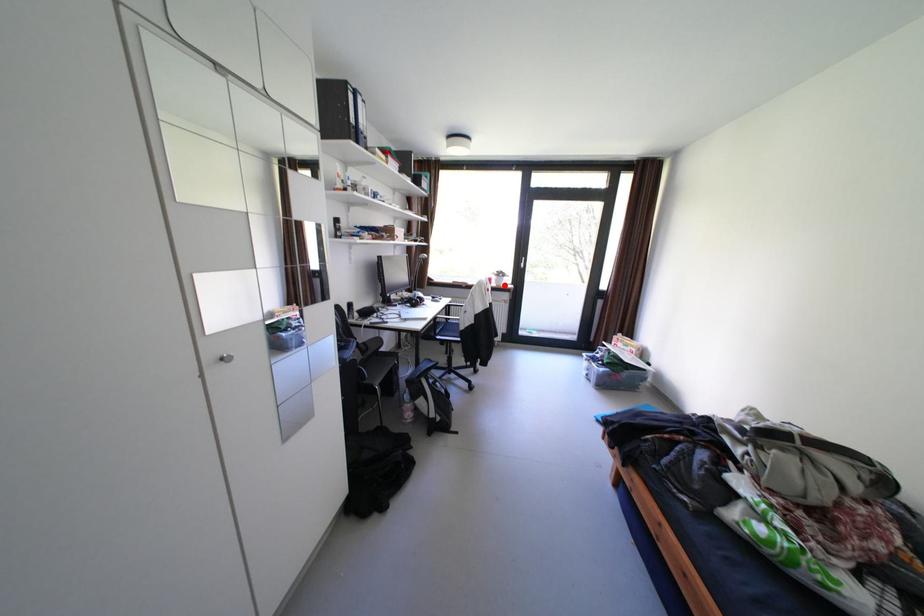
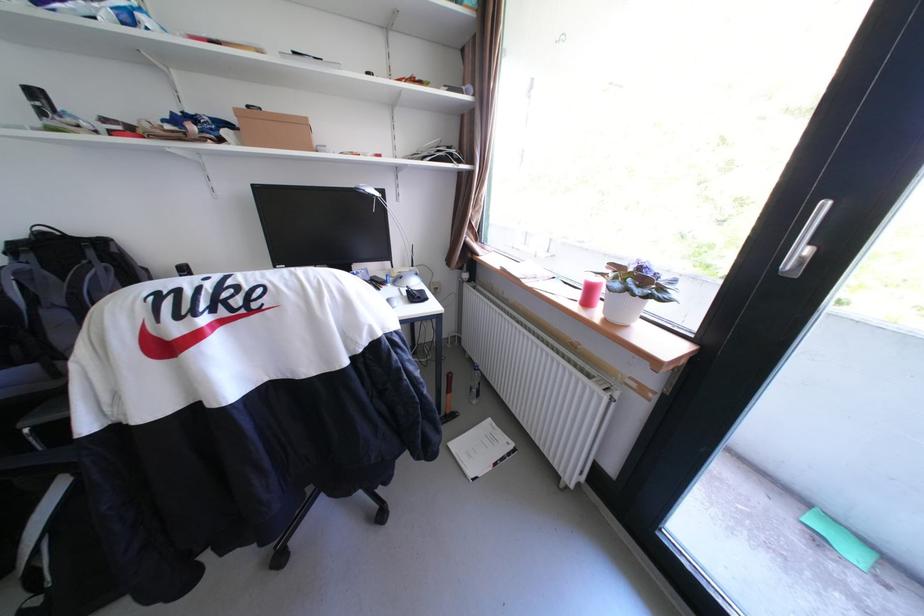
In the second image, find the point that corresponds to the highlighted location in the first image.

(608, 313)